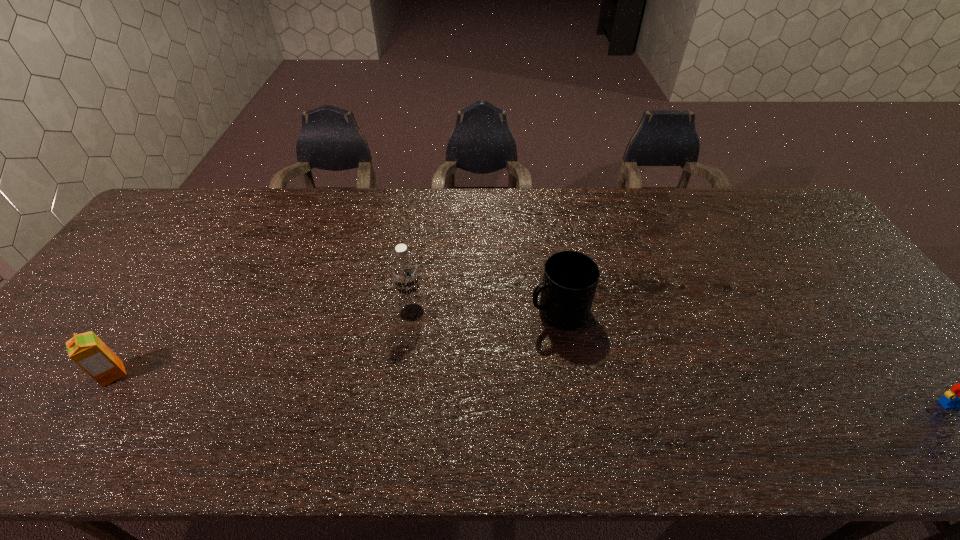
Where is `free space located on the front label of the vodka`? free space located on the front label of the vodka is located at coordinates (406, 370).

At what (x,y) coordinates should I click in order to perform the action: click on free point located on the front label of the vodka. Please return your answer as a coordinate pair (x, y). Looking at the image, I should click on (402, 409).

Identify the location of object located in the near edge section of the desktop. This screenshot has height=540, width=960. (87, 350).

At what (x,y) coordinates should I click in order to perform the action: click on free space at the far edge of the desktop. Please return your answer as a coordinate pair (x, y). The height and width of the screenshot is (540, 960). Looking at the image, I should click on (457, 204).

I want to click on blank area at the near edge, so click(659, 377).

In the image, there is a desktop. At what (x,y) coordinates should I click in order to perform the action: click on free space at the left edge. Please return your answer as a coordinate pair (x, y). This screenshot has height=540, width=960. Looking at the image, I should click on (71, 362).

Find the location of a particular element. The width and height of the screenshot is (960, 540). free region at the right edge is located at coordinates (819, 285).

Where is `vacant space at the far right corner of the desktop`? The height and width of the screenshot is (540, 960). vacant space at the far right corner of the desktop is located at coordinates (773, 217).

Image resolution: width=960 pixels, height=540 pixels. Identify the location of empty space between the third object from right to left and the second nearest object. click(x=262, y=343).

Locate an element on the screen. This screenshot has height=540, width=960. free space between the leftmost object and the third object from right to left is located at coordinates (262, 343).